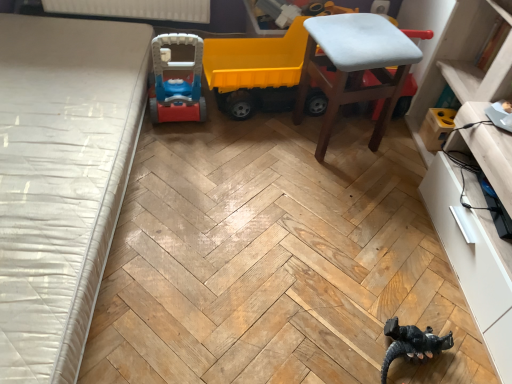
At what (x,y) coordinates should I click in order to perform the action: click on free region on the left part of light blue fabric stool at upper right. Please return your answer as a coordinate pair (x, y). This screenshot has height=384, width=512. Looking at the image, I should click on (263, 141).